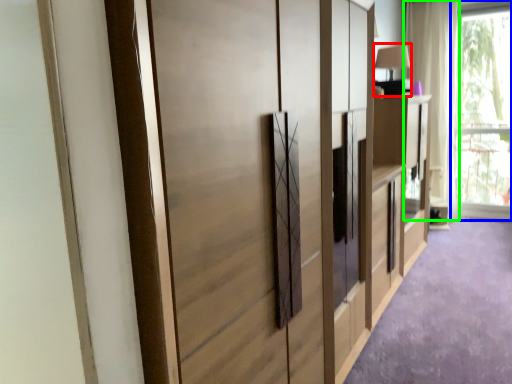
Question: Based on their relative distances, which object is farther from table lamp (highlighted by a red box)? Choose from window (highlighted by a blue box) and curtain (highlighted by a green box).

Choices:
 (A) window
 (B) curtain

Answer: (A)